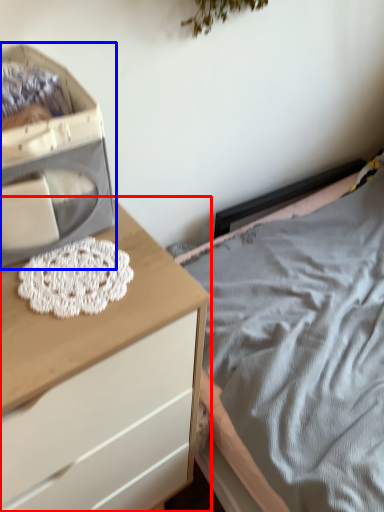
Question: Which point is further to the camera, chest of drawers (highlighted by a red box) or storage box (highlighted by a blue box)?

Choices:
 (A) chest of drawers
 (B) storage box

Answer: (B)